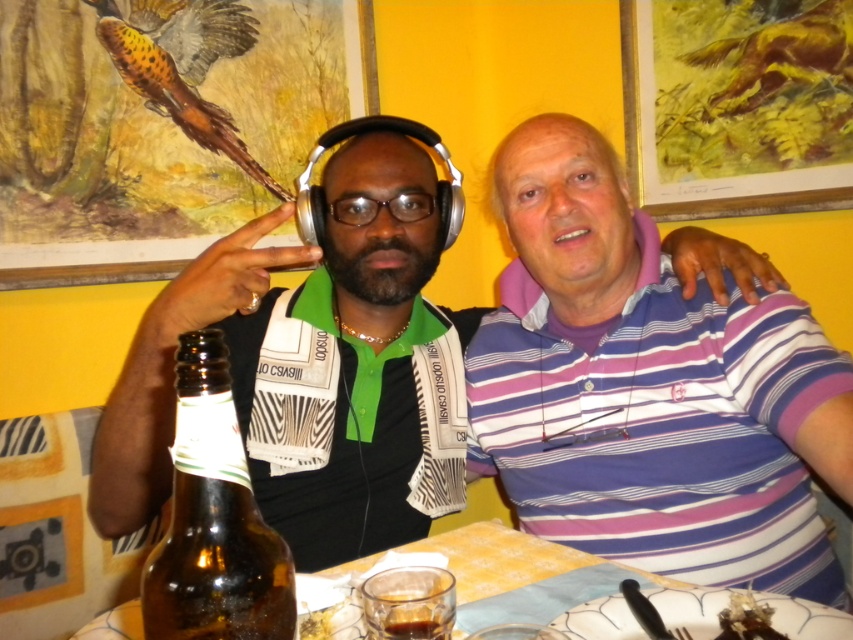
Is point (447, 616) more distant than point (352, 608)?

No, it is not.

At what (x,y) coordinates should I click in order to perform the action: click on translucent glass cup at table center. Please return your answer as a coordinate pair (x, y). The height and width of the screenshot is (640, 853). Looking at the image, I should click on (408, 604).

Locate an element on the screen. Image resolution: width=853 pixels, height=640 pixels. translucent glass cup at table center is located at coordinates (408, 604).

Between purple striped polo shirt at right and translucent glass at lower center, which one has less height?

Standing shorter between the two is translucent glass at lower center.

Does point (776, 561) come in front of point (355, 611)?

No, (776, 561) is behind (355, 611).

Identify the location of purple striped polo shirt at right. Image resolution: width=853 pixels, height=640 pixels. (648, 388).

Can you confirm if brown glass bottle at lower left is positioned to the right of shiny chocolate bar at lower right?

No, brown glass bottle at lower left is not to the right of shiny chocolate bar at lower right.

Can you confirm if brown glass bottle at lower left is positioned to the left of shiny chocolate bar at lower right?

Yes, brown glass bottle at lower left is to the left of shiny chocolate bar at lower right.

Between point (287, 595) and point (724, 637), which one is positioned behind?

Point (724, 637)

This screenshot has width=853, height=640. I want to click on brown glass bottle at lower left, so click(x=213, y=520).